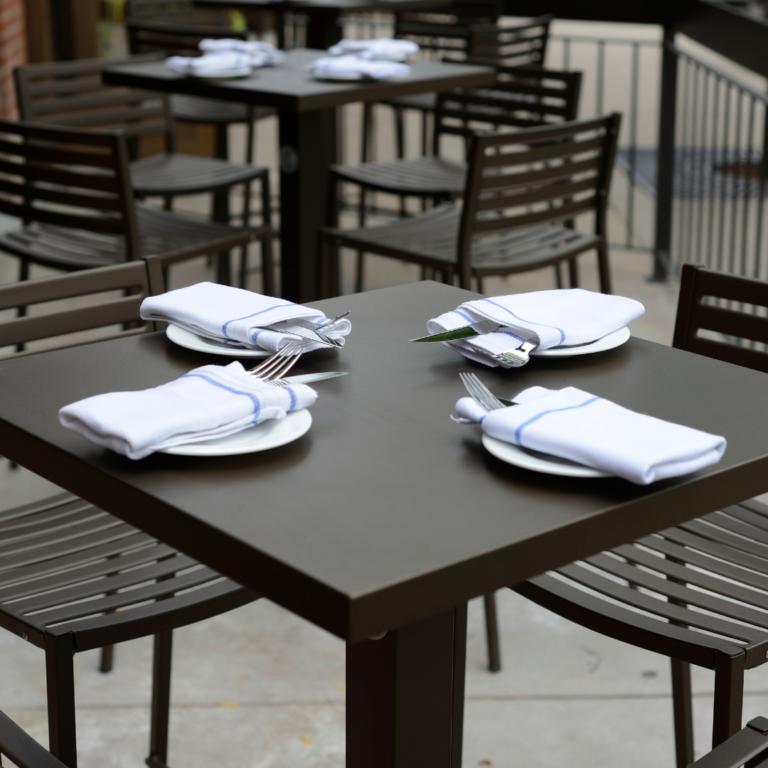
Image resolution: width=768 pixels, height=768 pixels. What are the coordinates of `napkins` in the screenshot? It's located at (219, 61), (227, 41), (359, 41), (359, 71), (227, 302), (207, 428), (554, 424), (545, 302).